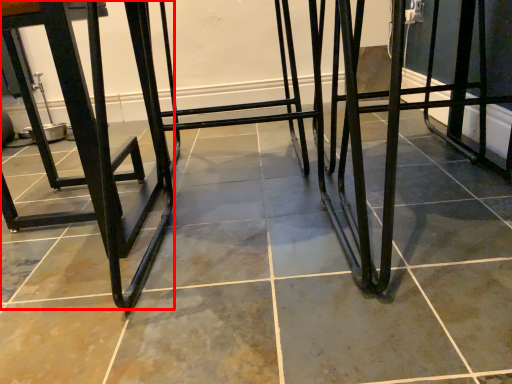
Question: From the image's perspective, what is the correct spatial positioning of furniture (annotated by the red box) in reference to step stool?

Choices:
 (A) below
 (B) above

Answer: (B)